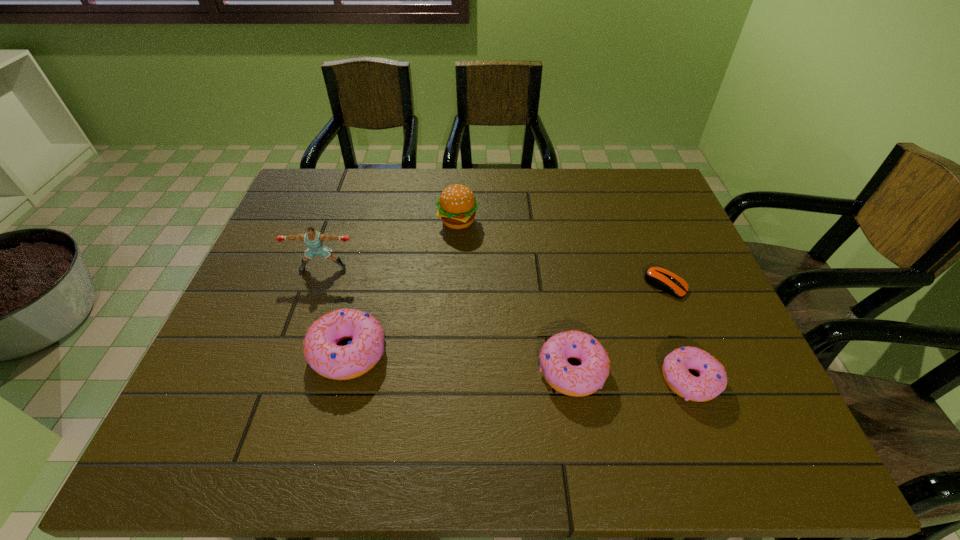
Find the location of a particular element. This screenshot has height=540, width=960. free point at the far edge is located at coordinates (x=452, y=175).

I want to click on blank area at the near edge, so click(x=409, y=400).

Where is `vacant position at the left edge of the desktop`? vacant position at the left edge of the desktop is located at coordinates (289, 260).

I want to click on blank space at the right edge of the desktop, so click(676, 235).

Where is `free region at the far left corner of the desktop`? free region at the far left corner of the desktop is located at coordinates tap(306, 200).

This screenshot has height=540, width=960. In the image, there is a desktop. Find the location of `vacant region at the far right corner`. vacant region at the far right corner is located at coordinates (619, 198).

Where is `free point between the leftmost doughnut and the third shortest object`? free point between the leftmost doughnut and the third shortest object is located at coordinates (461, 361).

Identify the location of vacant area that lies between the second tallest doughnut and the tallest object. This screenshot has width=960, height=540. (448, 319).

At what (x,y) coordinates should I click in order to perform the action: click on free area in between the tallest object and the fourth object from left to right. Please return your answer as a coordinate pair (x, y). Image resolution: width=960 pixels, height=540 pixels. Looking at the image, I should click on (448, 319).

I want to click on vacant region between the leftmost doughnut and the computer mouse, so click(x=507, y=319).